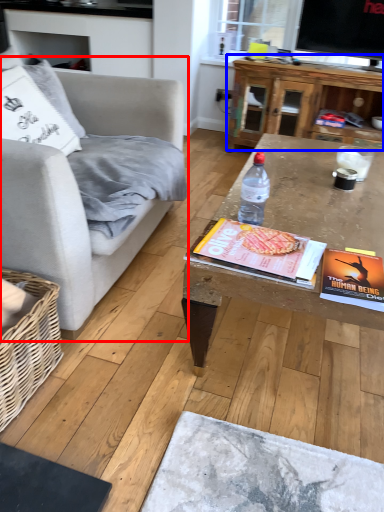
Question: Among these objects, which one is nearest to the camera, studio couch (highlighted by a red box) or table (highlighted by a blue box)?

Choices:
 (A) studio couch
 (B) table

Answer: (A)